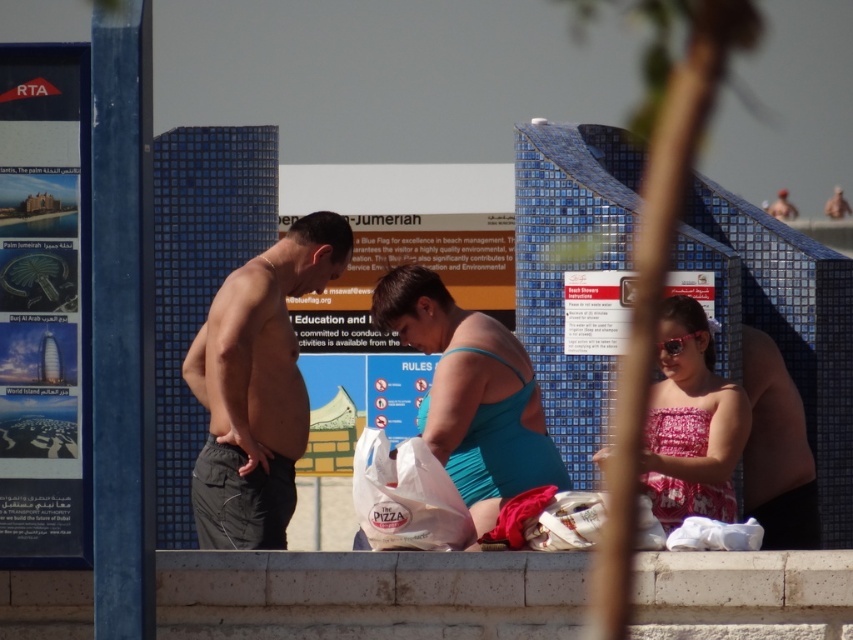
You are standing at the point with coordinates point [445,336]. You want to walk to the point [1,595]. Which direction should you move?

You should move forward because point [1,595] is in front of point [445,336].

You are a photographer standing at the edge of the beach, and you want to take a photo that includes both the gray fabric shorts at left and the smooth skin torso at center. Which object should you focus on first to ensure both are in clear view?

You should focus on the gray fabric shorts at left first since it is closer to the viewer than the smooth skin torso at center, ensuring both will be in focus when you focus on the closer object.

You are standing at the edge of the beach and want to reach the teal fabric swimsuit at center without stepping on the white concrete ledge at lower center. Is this possible?

The white concrete ledge at lower center is in front of the teal fabric swimsuit at center, so you would need to step over or around it to avoid stepping on the ledge.